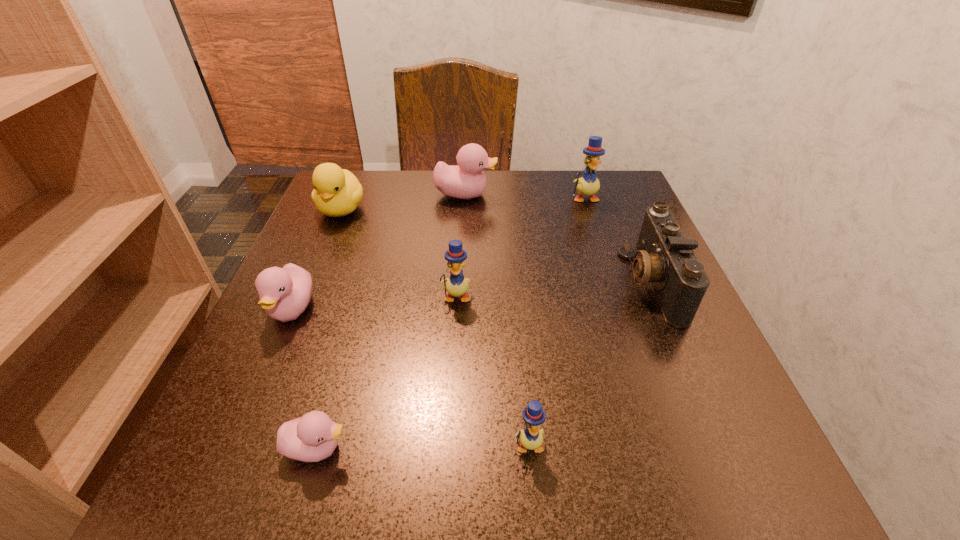
This screenshot has height=540, width=960. Identify the location of the biggest yellow duckling. (588, 184).

At what (x,y) coordinates should I click in order to perform the action: click on the rightmost duckling. Please return your answer as a coordinate pair (x, y). This screenshot has height=540, width=960. Looking at the image, I should click on pos(588,184).

You are a GUI agent. You are given a task and a screenshot of the screen. Output one action in this format:
    pyautogui.click(x=<x>, y=<y>)
    Task: Click on the rightmost pink duckling
    The image size is (960, 540).
    Given the screenshot: What is the action you would take?
    click(x=466, y=180)

This screenshot has width=960, height=540. I want to click on the farthest pink duckling, so click(466, 180).

At what (x,y) coordinates should I click in order to perform the action: click on duck. Please return your answer as a coordinate pair (x, y). Looking at the image, I should click on (337, 192).

The image size is (960, 540). Identify the location of the second biggest yellow duckling. (456, 285).

Find the location of a particular element. Image resolution: width=960 pixels, height=540 pixels. the second farthest yellow duckling is located at coordinates (456, 285).

The height and width of the screenshot is (540, 960). In order to click on camera in this screenshot , I will do `click(664, 257)`.

Locate an element on the screen. This screenshot has width=960, height=540. the second biggest pink duckling is located at coordinates (285, 292).

Identify the location of the second farthest pink duckling. The height and width of the screenshot is (540, 960). (285, 292).